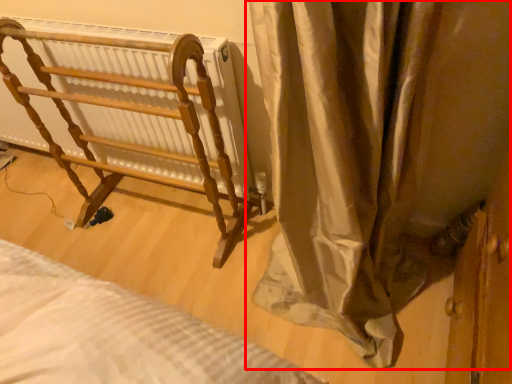
Question: Where is curtain (annotated by the red box) located in relation to furniture in the image?

Choices:
 (A) left
 (B) right

Answer: (B)